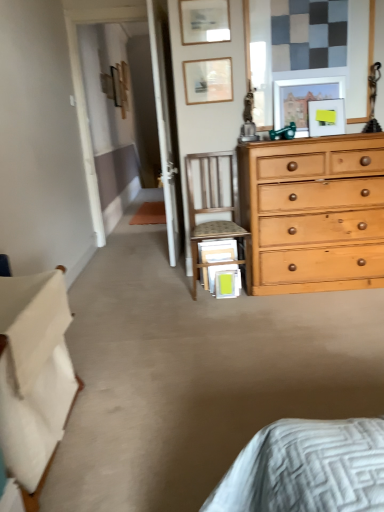
Question: Considering the positions of point (228, 28) and point (192, 194), is point (228, 28) closer or farther from the camera than point (192, 194)?

Choices:
 (A) farther
 (B) closer

Answer: (B)

Question: Relative to wooden chair at center, is matte wooden picture frame at upper center, acting as the first picture frame starting from the front, in front or behind?

Choices:
 (A) behind
 (B) front

Answer: (A)

Question: Which object is positioned farthest from the matte wooden picture frame at upper right, the second picture frame from the right?

Choices:
 (A) matte wooden picture frame at upper center, which is the 4th picture frame in right-to-left order
 (B) white fabric bed at lower left
 (C) wooden picture frame at upper center, which is counted as the first picture frame, starting from the back
 (D) wooden chair at center
 (E) wooden picture frame at upper center, the 2th picture frame in the back-to-front sequence

Answer: (C)

Question: Based on their relative distances, which object is nearer to the matte wooden picture frame at upper right, the second picture frame from the right?

Choices:
 (A) wooden picture frame at upper center, which is counted as the first picture frame, starting from the back
 (B) wooden chair at center
 (C) white fabric bed at lower left
 (D) yellow matte picture frame at upper center, which is counted as the 5th picture frame, starting from the top
 (E) wooden picture frame at upper center, the 3th picture frame positioned from the bottom

Answer: (D)